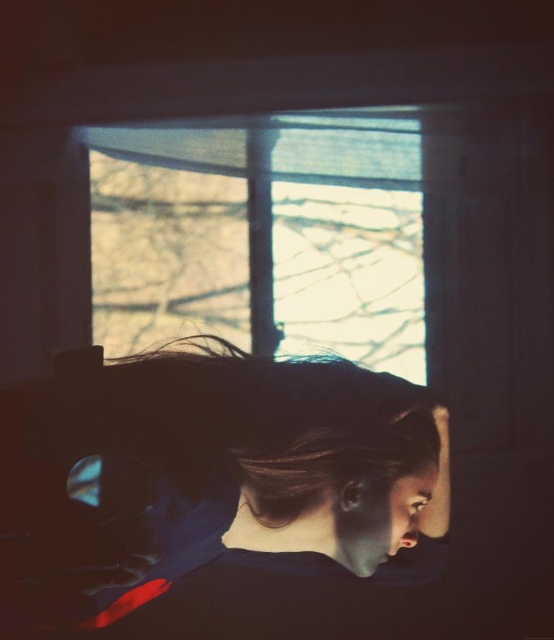
Can you confirm if matte black hair at center is shorter than translucent glass window at upper center?

Incorrect, matte black hair at center's height does not fall short of translucent glass window at upper center's.

Between point (35, 422) and point (105, 237), which one is positioned in front?

Point (35, 422) is more forward.

Image resolution: width=554 pixels, height=640 pixels. Find the location of `matte black hair at center`. matte black hair at center is located at coordinates (216, 497).